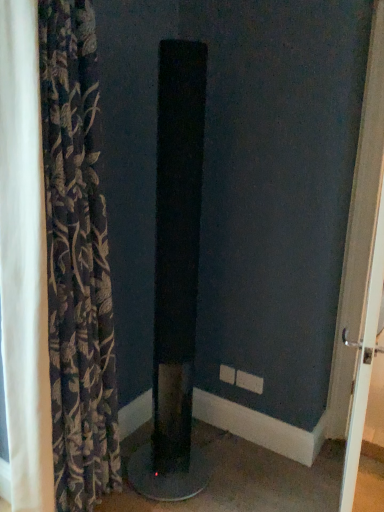
Question: Can you confirm if dark floral fabric curtain at left is taller than white glossy door handle at right?

Choices:
 (A) yes
 (B) no

Answer: (A)

Question: From a real-world perspective, is dark floral fabric curtain at left positioned under white glossy door handle at right based on gravity?

Choices:
 (A) yes
 (B) no

Answer: (B)

Question: Is dark floral fabric curtain at left closer to camera compared to white glossy door handle at right?

Choices:
 (A) no
 (B) yes

Answer: (B)

Question: Is dark floral fabric curtain at left far from white glossy door handle at right?

Choices:
 (A) no
 (B) yes

Answer: (B)

Question: Is white glossy door handle at right inside dark floral fabric curtain at left?

Choices:
 (A) yes
 (B) no

Answer: (B)

Question: Is dark floral fabric curtain at left not within white glossy door handle at right?

Choices:
 (A) yes
 (B) no

Answer: (A)

Question: Is dark floral fabric curtain at left wider than black matte speaker at center?

Choices:
 (A) yes
 (B) no

Answer: (B)

Question: Does dark floral fabric curtain at left lie in front of black matte speaker at center?

Choices:
 (A) no
 (B) yes

Answer: (B)

Question: Does dark floral fabric curtain at left have a larger size compared to black matte speaker at center?

Choices:
 (A) yes
 (B) no

Answer: (A)

Question: Does dark floral fabric curtain at left have a lesser width compared to black matte speaker at center?

Choices:
 (A) no
 (B) yes

Answer: (B)

Question: Is dark floral fabric curtain at left completely or partially outside of black matte speaker at center?

Choices:
 (A) no
 (B) yes

Answer: (B)

Question: Can you confirm if dark floral fabric curtain at left is positioned to the right of black matte speaker at center?

Choices:
 (A) no
 (B) yes

Answer: (A)

Question: Is white glossy door handle at right at the right side of dark floral fabric curtain at left?

Choices:
 (A) yes
 (B) no

Answer: (A)